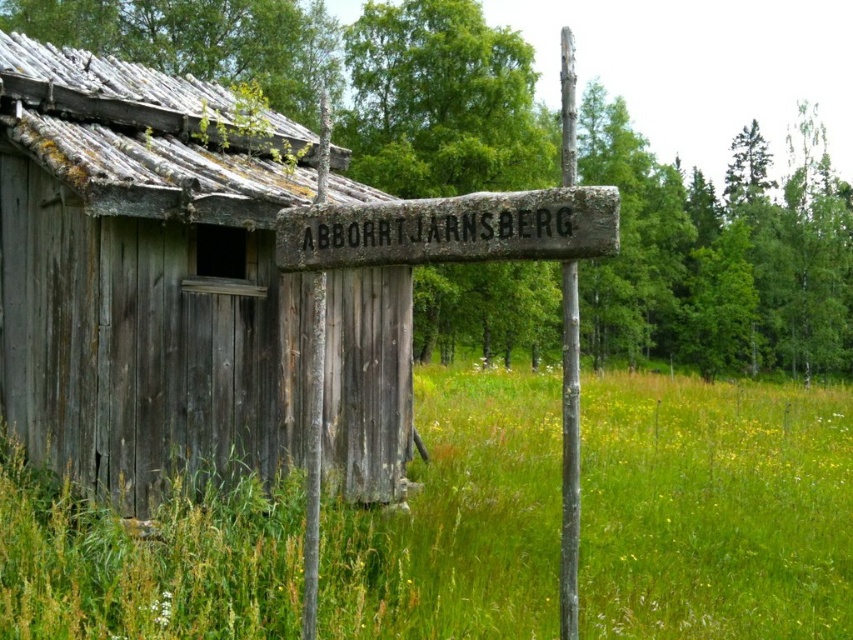
You are standing in the green grassy field at center and want to reach the weathered wood hut at center. Which direction should you move to get there?

Since the green grassy field at center is to the right of the weathered wood hut at center, you should move to the left to reach the hut.

You are standing in a field and want to take a photo of the weathered wood hut at center. If your camera has a maximum focus range of 7 meters, will you need to move closer to capture the hut clearly?

The weathered wood hut at center is 7.58 meters away from the camera. Since the maximum focus range is 7 meters, you need to move closer to ensure the hut is in focus.

Looking at this image, you are standing in front of the rustic wooden structure and notice two points marked on the ground. The first point is at coordinates point (16, 93) and the second is at point (396, 241). Which point is closer to you?

Point (16, 93) is closer to you because it is further to the viewer than point (396, 241).